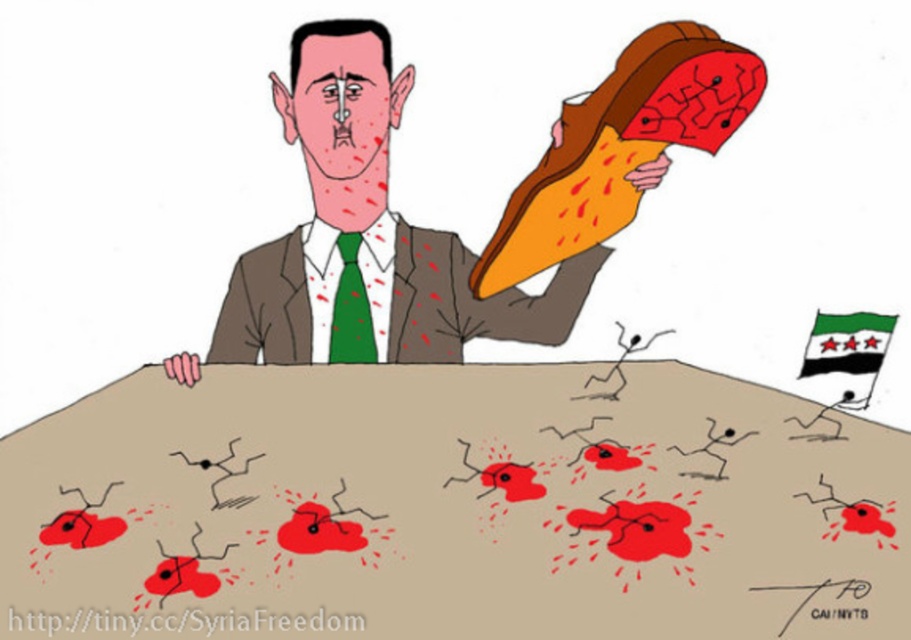
Based on the scene described, which object is located below the other? The beige matte table at center or the brown textured suit at center?

The beige matte table at center is positioned under the brown textured suit at center.

You are an observer analyzing the political cartoon. The cartoon shows a man in a brown textured suit at center holding a pizza slice while his green tie at upper left is positioned in front of the suit. Based on their spatial arrangement, which object is closer to the viewer?

The green tie at upper left is closer to the viewer because it is in front of the brown textured suit at center.